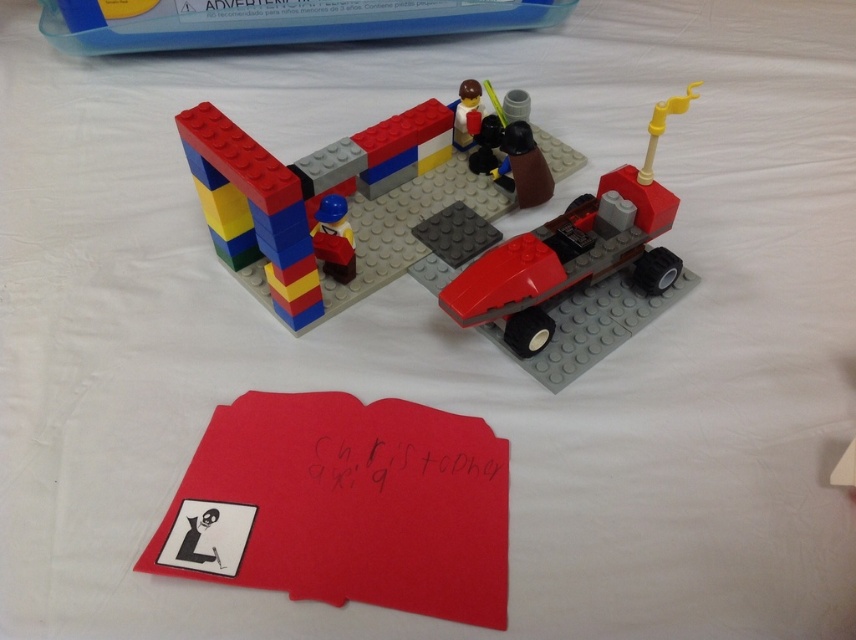
Who is more forward, (372, 492) or (381, 220)?

Point (372, 492)

Between matte red folder at lower center and brick-like colorful building at center, which one appears on the left side from the viewer's perspective?

matte red folder at lower center

Find the location of a particular element. This screenshot has width=856, height=640. matte red folder at lower center is located at coordinates (345, 506).

Locate an element on the screen. The height and width of the screenshot is (640, 856). brick-like colorful building at center is located at coordinates (318, 202).

Does brick-like colorful building at center have a lesser height compared to shiny red car at center?

Indeed, brick-like colorful building at center has a lesser height compared to shiny red car at center.

What do you see at coordinates (318, 202) in the screenshot?
I see `brick-like colorful building at center` at bounding box center [318, 202].

You are a GUI agent. You are given a task and a screenshot of the screen. Output one action in this format:
    pyautogui.click(x=<x>, y=<y>)
    Task: Click on the brick-like colorful building at center
    The image size is (856, 640).
    Given the screenshot: What is the action you would take?
    pyautogui.click(x=318, y=202)